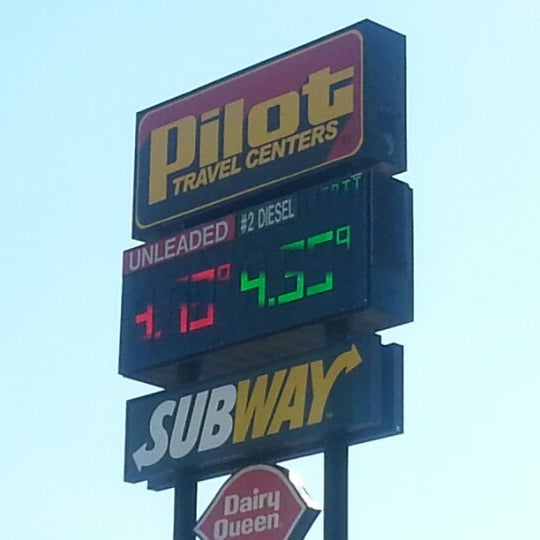
This screenshot has height=540, width=540. I want to click on support post, so click(187, 492), click(340, 463).